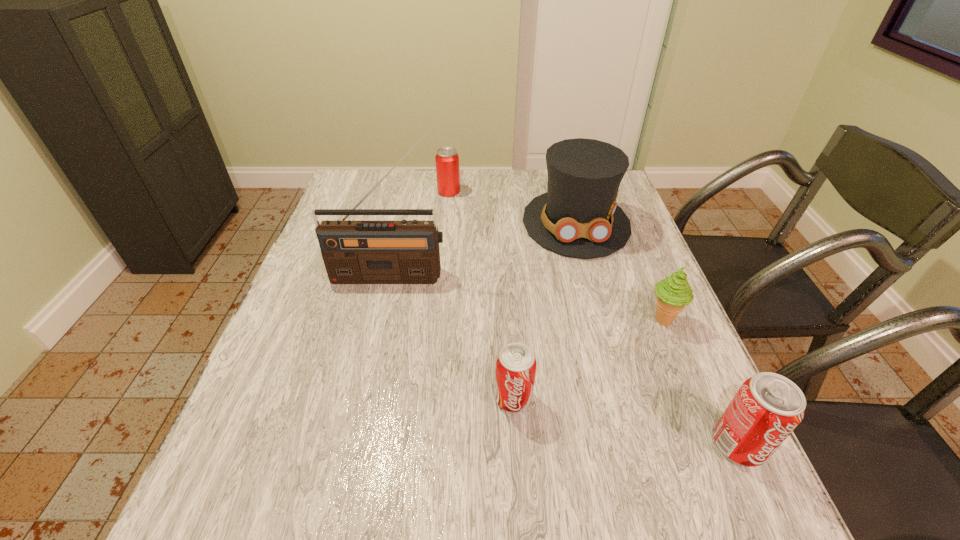
Where is `the farther soda can`? The height and width of the screenshot is (540, 960). the farther soda can is located at coordinates (516, 364).

Where is `the left soda can`? The image size is (960, 540). the left soda can is located at coordinates (516, 364).

Where is `the taller soda can`? the taller soda can is located at coordinates (766, 409).

Where is `the nearest object`? This screenshot has width=960, height=540. the nearest object is located at coordinates (766, 409).

Identify the location of dress hat. (578, 216).

Find the location of a particular element. The height and width of the screenshot is (540, 960). can is located at coordinates (447, 159).

Where is `radio receiver`? This screenshot has width=960, height=540. radio receiver is located at coordinates point(354,252).

Locate an element on the screen. the fourth nearest object is located at coordinates (354, 252).

In order to click on icecream in this screenshot , I will do `click(673, 293)`.

The image size is (960, 540). Find the location of `vacant space located on the left of the third object from left to right`. vacant space located on the left of the third object from left to right is located at coordinates (402, 398).